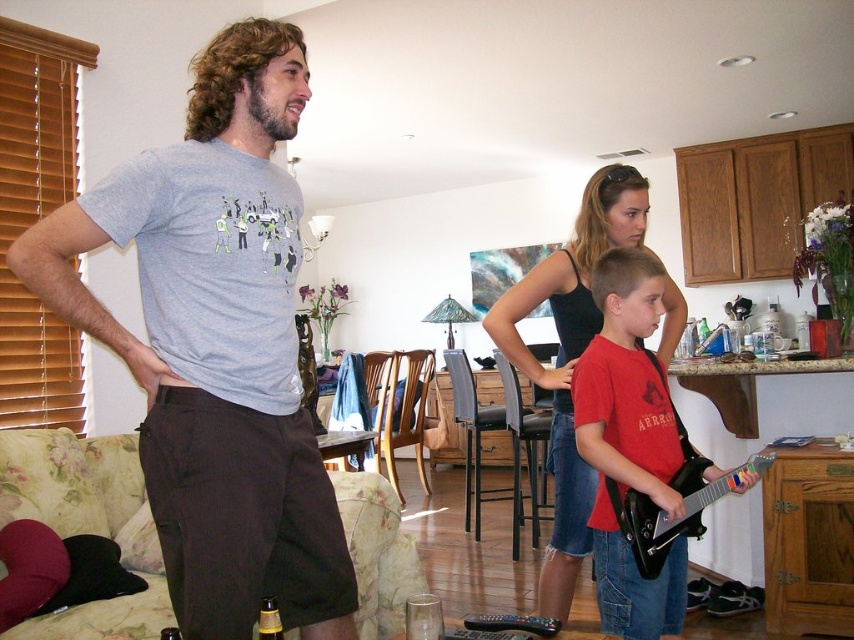
Question: Which object is the closest to the black tank top at center?

Choices:
 (A) gray t-shirt at center
 (B) red matte guitar at lower right

Answer: (B)

Question: Which object appears closest to the camera in this image?

Choices:
 (A) gray t-shirt at center
 (B) black tank top at center

Answer: (A)

Question: From the image, what is the correct spatial relationship of gray t-shirt at center in relation to black tank top at center?

Choices:
 (A) above
 (B) below

Answer: (A)

Question: Is gray t-shirt at center above black tank top at center?

Choices:
 (A) no
 (B) yes

Answer: (B)

Question: Which point is farther to the camera?

Choices:
 (A) (603, 552)
 (B) (588, 212)
 (C) (174, 481)

Answer: (B)

Question: Is red matte guitar at lower right wider than black tank top at center?

Choices:
 (A) yes
 (B) no

Answer: (B)